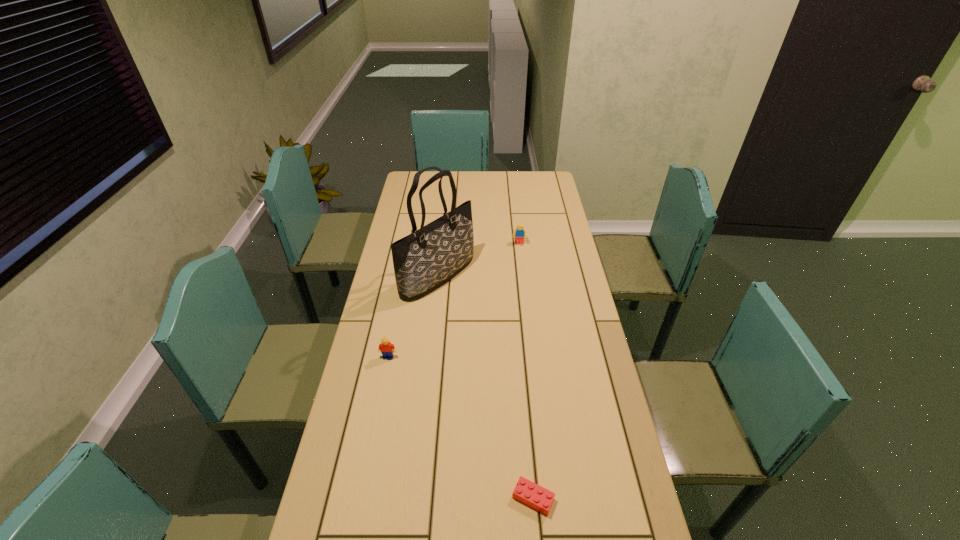
Locate an element on the screen. Image resolution: width=960 pixels, height=540 pixels. the tallest object is located at coordinates (429, 257).

Locate an element on the screen. Image resolution: width=960 pixels, height=540 pixels. tote bag is located at coordinates (429, 257).

Locate an element on the screen. The image size is (960, 540). the farthest object is located at coordinates (519, 233).

I want to click on the third farthest object, so click(387, 349).

Where is `the second farthest Lego`? The height and width of the screenshot is (540, 960). the second farthest Lego is located at coordinates [x=387, y=349].

Where is `the shortest Lego`? the shortest Lego is located at coordinates (x=527, y=492).

I want to click on the nearest Lego, so click(x=527, y=492).

This screenshot has height=540, width=960. I want to click on vacant space located on the right of the tote bag, so click(x=564, y=276).

Where is `vacant area situated 0.130m on the front-facing side of the farthest object`? The image size is (960, 540). vacant area situated 0.130m on the front-facing side of the farthest object is located at coordinates (521, 266).

The width and height of the screenshot is (960, 540). What are the coordinates of `free spot located on the face of the third farthest object` in the screenshot? It's located at (376, 419).